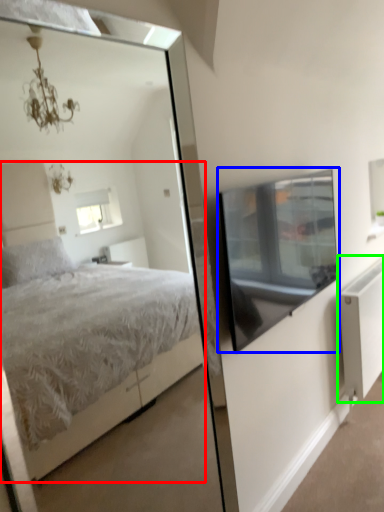
Question: Estimate the real-world distances between objects in this image. Which object is farther from bed (highlighted by a red box), window screen (highlighted by a blue box) or radiator (highlighted by a green box)?

Choices:
 (A) window screen
 (B) radiator

Answer: (A)